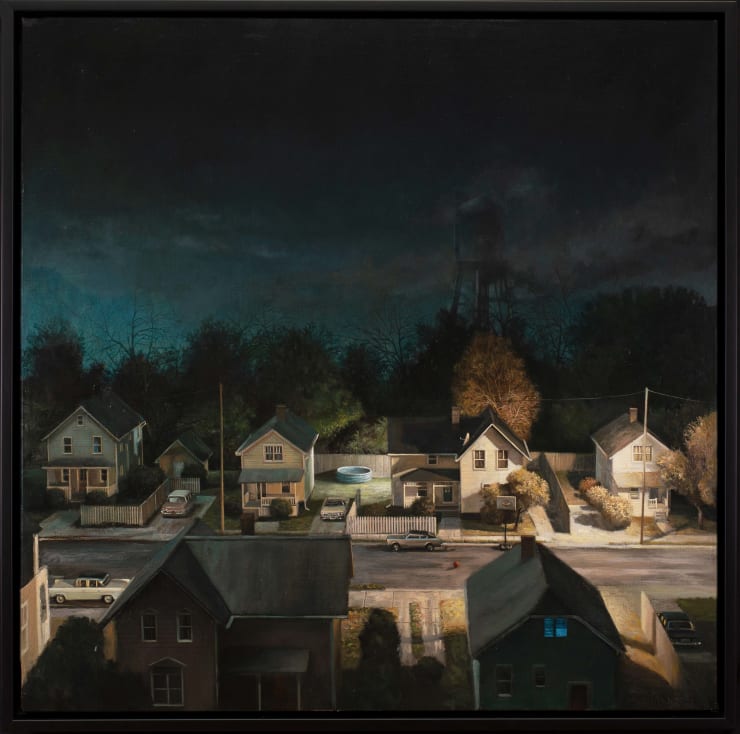
At what (x,y) coordinates should I click in order to perform the action: click on yellow light. Please return your answer as a coordinate pair (x, y). Looking at the image, I should click on (593, 528), (428, 606), (70, 610), (474, 468).